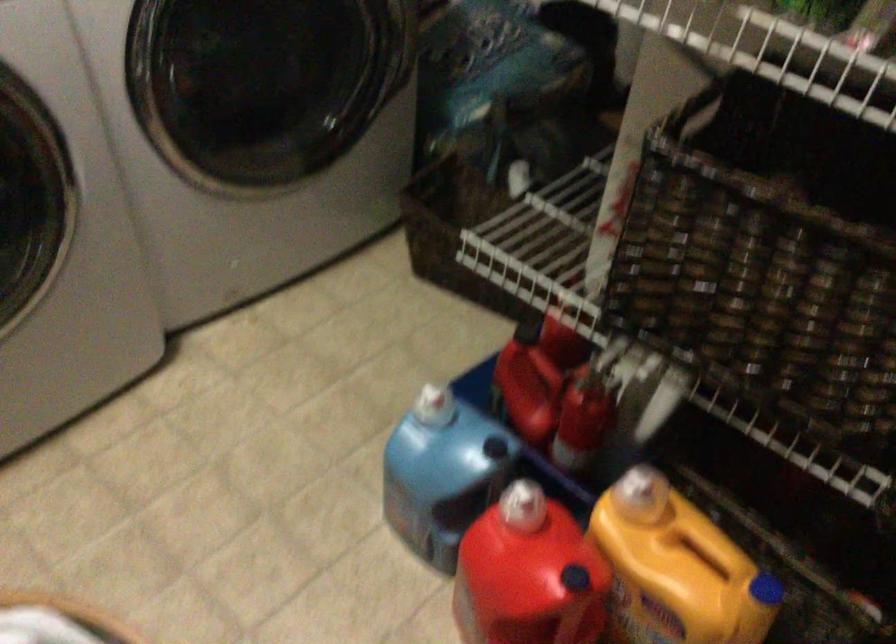
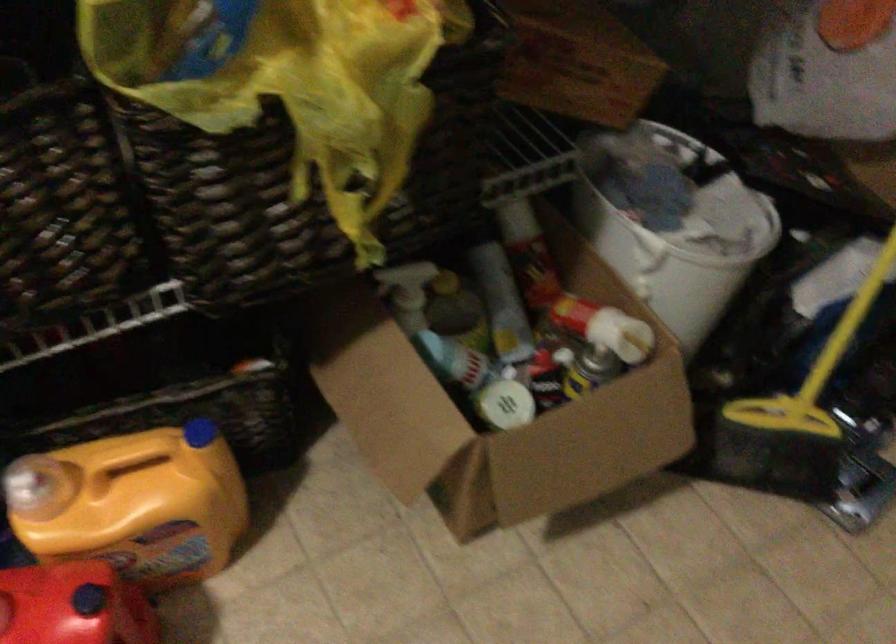
In the second image, find the point that corresponds to (566,574) in the first image.

(73, 605)